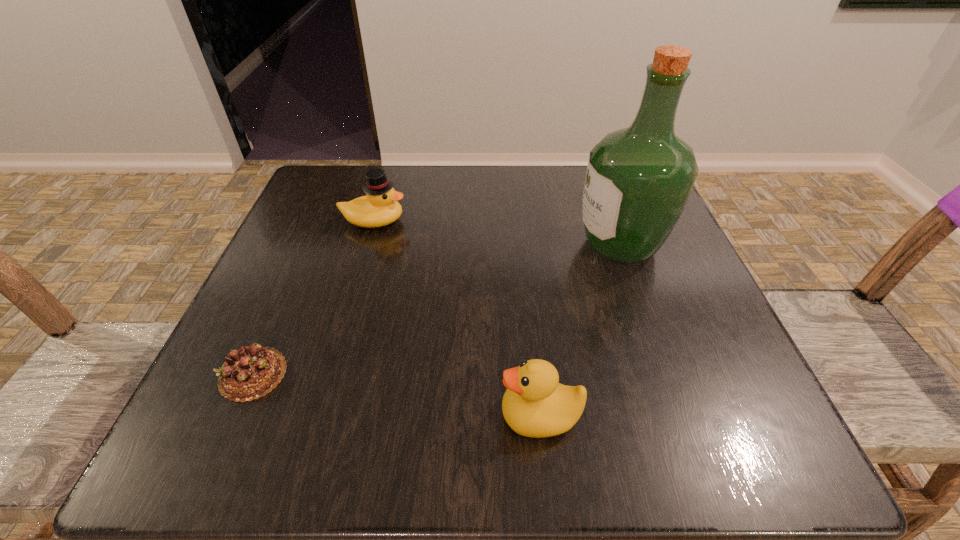
Where is `the tallest object`? the tallest object is located at coordinates (638, 180).

This screenshot has height=540, width=960. In order to click on liquor in this screenshot , I will do `click(638, 180)`.

The height and width of the screenshot is (540, 960). What are the coordinates of `the second object from right to left` in the screenshot? It's located at (535, 404).

I want to click on the nearer duck, so click(x=535, y=404).

The image size is (960, 540). What are the coordinates of `the farther duck` in the screenshot? It's located at (380, 207).

The image size is (960, 540). What are the coordinates of `the shortest object` in the screenshot? It's located at (251, 372).

Where is `vacant space positioned 0.260m on the front-facing side of the tallest object`? The width and height of the screenshot is (960, 540). vacant space positioned 0.260m on the front-facing side of the tallest object is located at coordinates (442, 244).

The image size is (960, 540). I want to click on vacant region located on the front-facing side of the tallest object, so click(x=539, y=244).

Image resolution: width=960 pixels, height=540 pixels. In order to click on vacant region located on the front-facing side of the tallest object in this screenshot , I will do `click(417, 244)`.

Where is `free location located 0.390m at the beak of the third object from left to right`? The image size is (960, 540). free location located 0.390m at the beak of the third object from left to right is located at coordinates (216, 416).